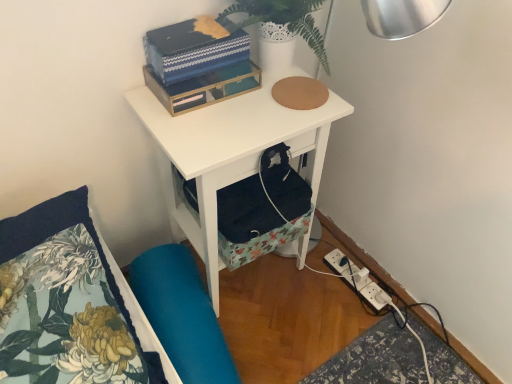
Locate an element on the screen. Image resolution: width=512 pixels, height=384 pixels. floral fabric pillow at lower left is located at coordinates (81, 290).

What is the approximate height of white matte nightstand at upper center?

white matte nightstand at upper center is 27.76 inches tall.

Describe the element at coordinates (192, 51) in the screenshot. Image resolution: width=512 pixels, height=384 pixels. I see `blue textured box at upper center` at that location.

Describe the element at coordinates (281, 20) in the screenshot. I see `white textured vase at upper center` at that location.

Image resolution: width=512 pixels, height=384 pixels. I want to click on floral fabric pillow at lower left, so click(81, 290).

In the scene shown: Is the surface of floral fabric pillow at lower left in direct contact with white textured vase at upper center?

floral fabric pillow at lower left and white textured vase at upper center are not in contact.

Considering the relative positions of floral fabric pillow at lower left and white textured vase at upper center in the image provided, is floral fabric pillow at lower left to the right of white textured vase at upper center from the viewer's perspective?

In fact, floral fabric pillow at lower left is to the left of white textured vase at upper center.

From a real-world perspective, which object rests below the other?

floral fabric pillow at lower left is physically lower.

The width and height of the screenshot is (512, 384). In order to click on plant above the floral fabric pillow at lower left (from the image's perspective) in this screenshot , I will do `click(281, 20)`.

Between point (136, 350) and point (185, 366), which one is positioned in front?

The point (136, 350) is in front.

How distant is floral fabric pillow at lower left from teal fabric swivel chair at lower left?

floral fabric pillow at lower left and teal fabric swivel chair at lower left are 13.40 inches apart from each other.

Which of these two, floral fabric pillow at lower left or teal fabric swivel chair at lower left, is thinner?

teal fabric swivel chair at lower left is thinner.

Between floral fabric pillow at lower left and teal fabric swivel chair at lower left, which one has more height?

Standing taller between the two is teal fabric swivel chair at lower left.

From the image's perspective, is white textured vase at upper center located beneath teal fabric swivel chair at lower left?

No.

Considering the sizes of white textured vase at upper center and teal fabric swivel chair at lower left in the image, is white textured vase at upper center bigger or smaller than teal fabric swivel chair at lower left?

white textured vase at upper center is smaller than teal fabric swivel chair at lower left.

In the image, is white textured vase at upper center positioned in front of or behind teal fabric swivel chair at lower left?

In the image, white textured vase at upper center appears in front of teal fabric swivel chair at lower left.

This screenshot has height=384, width=512. In the image, there is a white textured vase at upper center. Find the location of `swivel chair below it (from the image's perspective)`. swivel chair below it (from the image's perspective) is located at coordinates (182, 314).

Is point (341, 267) farther from camera compared to point (92, 284)?

Yes, point (341, 267) is behind point (92, 284).

Based on their positions, is white plastic power strip at lower right located to the left or right of floral fabric pillow at lower left?

From the image, it's evident that white plastic power strip at lower right is to the right of floral fabric pillow at lower left.

From the image's perspective, which is above, white plastic power strip at lower right or floral fabric pillow at lower left?

From the image's view, floral fabric pillow at lower left is above.

Which object is wider, white plastic power strip at lower right or floral fabric pillow at lower left?

With larger width is floral fabric pillow at lower left.

Looking at their sizes, would you say white plastic power strip at lower right is wider or thinner than blue textured box at upper center?

In the image, white plastic power strip at lower right appears to be wider than blue textured box at upper center.

Between white plastic power strip at lower right and blue textured box at upper center, which one has less height?

white plastic power strip at lower right is shorter.

The image size is (512, 384). Identify the location of book on the left of white plastic power strip at lower right. (192, 51).

Does point (355, 272) lie behind point (181, 52)?

Yes, it is.

Would you say blue textured box at upper center is a long distance from floral fabric pillow at lower left?

blue textured box at upper center is near floral fabric pillow at lower left, not far away.

Is blue textured box at upper center aimed at floral fabric pillow at lower left?

No, blue textured box at upper center is not aimed at floral fabric pillow at lower left.

From the image's perspective, is blue textured box at upper center located above floral fabric pillow at lower left?

Indeed, from the image's perspective, blue textured box at upper center is shown above floral fabric pillow at lower left.

Can you confirm if blue textured box at upper center is smaller than floral fabric pillow at lower left?

Yes, blue textured box at upper center is smaller than floral fabric pillow at lower left.

Find the location of a particular element. The height and width of the screenshot is (384, 512). electric outlet below the white matte nightstand at upper center (from the image's perspective) is located at coordinates (358, 279).

Choose the correct answer: Is white plastic power strip at lower right inside white matte nightstand at upper center or outside it?

The correct answer is: outside.

Is white plastic power strip at lower right at the left side of white matte nightstand at upper center?

Incorrect, white plastic power strip at lower right is not on the left side of white matte nightstand at upper center.

From the image's perspective, which object appears higher, white plastic power strip at lower right or white matte nightstand at upper center?

Answer: white matte nightstand at upper center, from the image's perspective.

Locate an element on the screen. pillow below the white textured vase at upper center (from the image's perspective) is located at coordinates click(x=81, y=290).

Locate an element on the screen. The image size is (512, 384). pillow above the teal fabric swivel chair at lower left (from the image's perspective) is located at coordinates (81, 290).

When comparing their distances from floral fabric pillow at lower left, does teal fabric swivel chair at lower left or white matte nightstand at upper center seem closer?

Based on the image, teal fabric swivel chair at lower left appears to be nearer to floral fabric pillow at lower left.

Estimate the real-world distances between objects in this image. Which object is closer to white matte nightstand at upper center, floral fabric pillow at lower left or white plastic power strip at lower right?

Based on the image, floral fabric pillow at lower left appears to be nearer to white matte nightstand at upper center.

Considering their positions, is white plastic power strip at lower right positioned further to floral fabric pillow at lower left than white matte nightstand at upper center?

The object further to floral fabric pillow at lower left is white plastic power strip at lower right.

From the image, which object appears to be farther from blue textured box at upper center, white textured vase at upper center or white matte nightstand at upper center?

The object further to blue textured box at upper center is white matte nightstand at upper center.

From the image, which object appears to be nearer to white textured vase at upper center, floral fabric pillow at lower left or blue textured box at upper center?

The object closer to white textured vase at upper center is blue textured box at upper center.

Consider the image. Considering their positions, is white plastic power strip at lower right positioned further to floral fabric pillow at lower left than blue textured box at upper center?

white plastic power strip at lower right.

Consider the image. Looking at the image, which one is located further to white matte nightstand at upper center, blue textured box at upper center or white plastic power strip at lower right?

Based on the image, white plastic power strip at lower right appears to be further to white matte nightstand at upper center.

Based on their spatial positions, is teal fabric swivel chair at lower left or white textured vase at upper center closer to blue textured box at upper center?

white textured vase at upper center is positioned closer to the anchor blue textured box at upper center.

At what (x,y) coordinates should I click in order to perform the action: click on nightstand between white textured vase at upper center and white plastic power strip at lower right from top to bottom. Please return your answer as a coordinate pair (x, y). Looking at the image, I should click on [x=230, y=152].

You are a GUI agent. You are given a task and a screenshot of the screen. Output one action in this format:
    pyautogui.click(x=<x>, y=<y>)
    Task: Click on the nightstand between white textured vase at upper center and floral fabric pillow at lower left in the vertical direction
    Image resolution: width=512 pixels, height=384 pixels.
    Given the screenshot: What is the action you would take?
    pyautogui.click(x=230, y=152)

Image resolution: width=512 pixels, height=384 pixels. Find the location of `nightstand between white textured vase at upper center and teal fabric swivel chair at lower left vertically`. nightstand between white textured vase at upper center and teal fabric swivel chair at lower left vertically is located at coordinates (230, 152).

What are the coordinates of `book between floral fabric pillow at lower left and white plastic power strip at lower right in the front-back direction` in the screenshot? It's located at (192, 51).